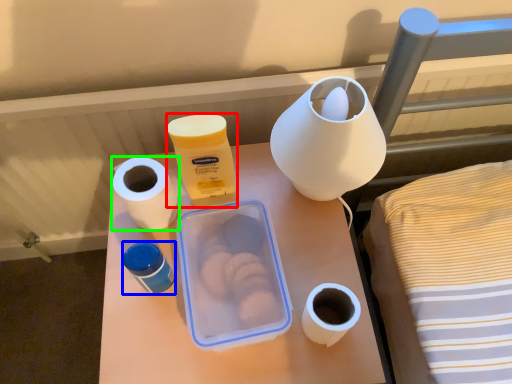
Question: Which object is positioned farthest from product (highlighted by a red box)? Select from pottery (highlighted by a blue box) and paper towel (highlighted by a green box).

Choices:
 (A) pottery
 (B) paper towel

Answer: (A)